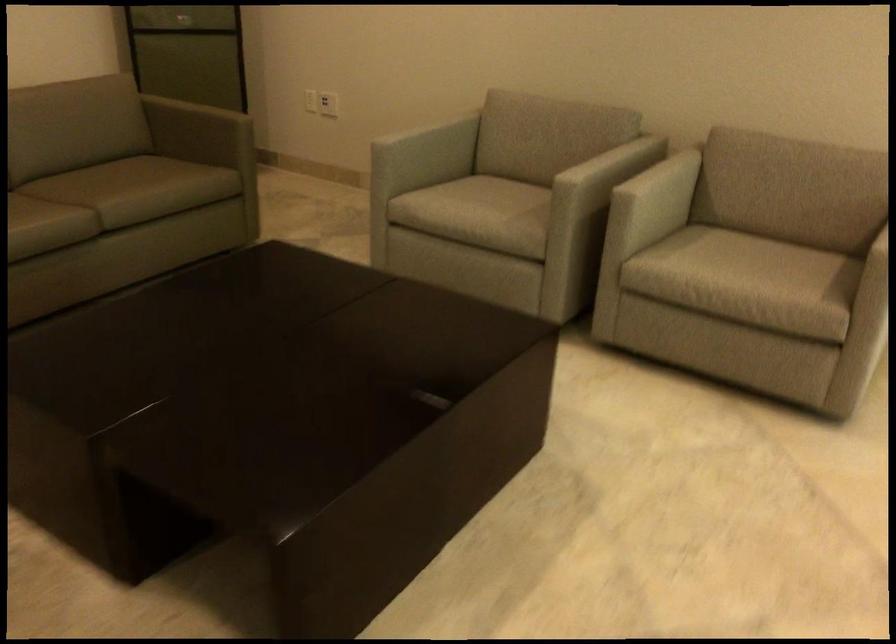
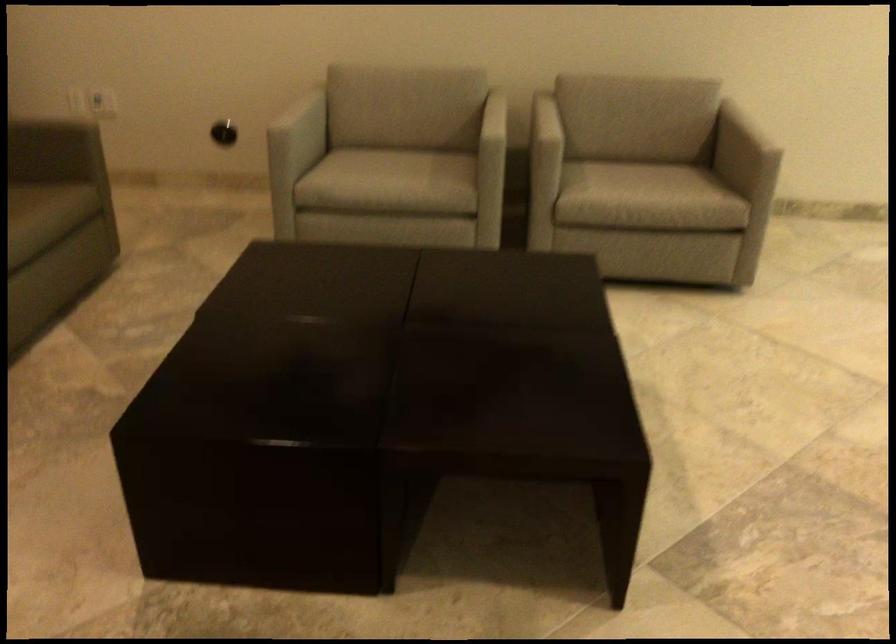
The point at [444,147] is marked in the first image. Where is the corresponding point in the second image?

(304, 124)